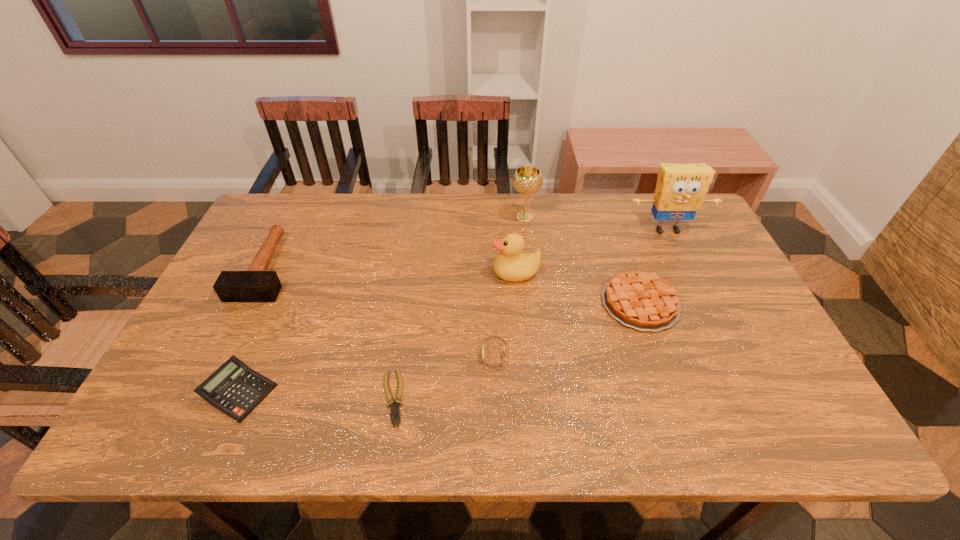
Find the location of a particular element. Image resolution: width=960 pixels, height=540 pixels. sponge is located at coordinates (680, 190).

I want to click on the seventh shortest object, so click(527, 180).

Identify the location of duck. The height and width of the screenshot is (540, 960). (511, 265).

The width and height of the screenshot is (960, 540). Identify the location of mallet. (256, 284).

Find the location of a particular element. This screenshot has width=960, height=540. pie is located at coordinates (638, 299).

At what (x,y) coordinates should I click in order to perform the action: click on watch. Please return your answer as a coordinate pair (x, y). Looking at the image, I should click on (501, 364).

Locate an element on the screen. Image resolution: width=960 pixels, height=540 pixels. calculator is located at coordinates (235, 389).

You are a GUI agent. You are given a task and a screenshot of the screen. Output one action in this format:
    pyautogui.click(x=<x>, y=<y>)
    Task: Click on the shortest object
    The image size is (960, 540).
    Given the screenshot: What is the action you would take?
    pyautogui.click(x=394, y=409)

I want to click on the sixth object from right to left, so click(x=394, y=409).

At what (x,y) coordinates should I click in order to perform the action: click on free space located 0.300m on the face of the tallest object. Please return your answer as a coordinate pair (x, y). Looking at the image, I should click on (707, 314).